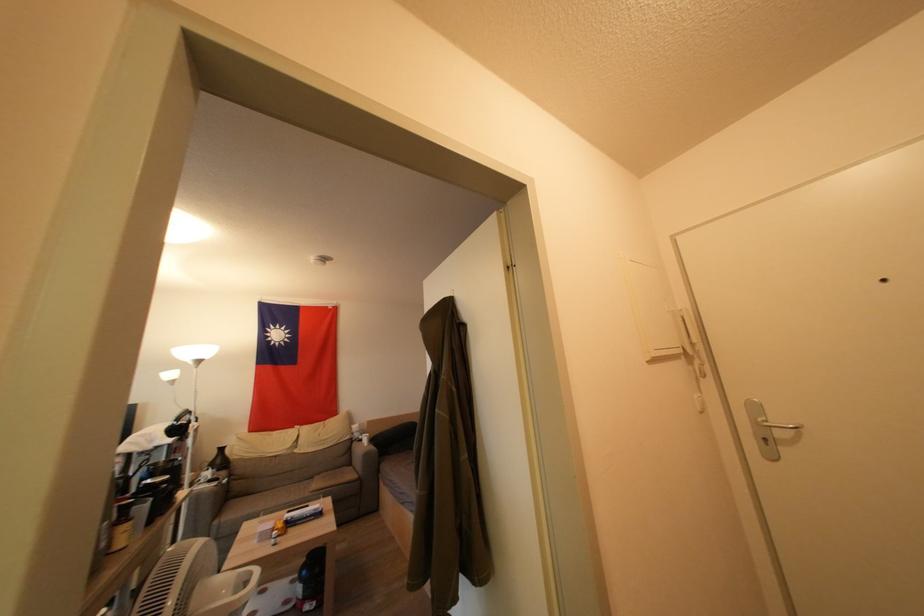
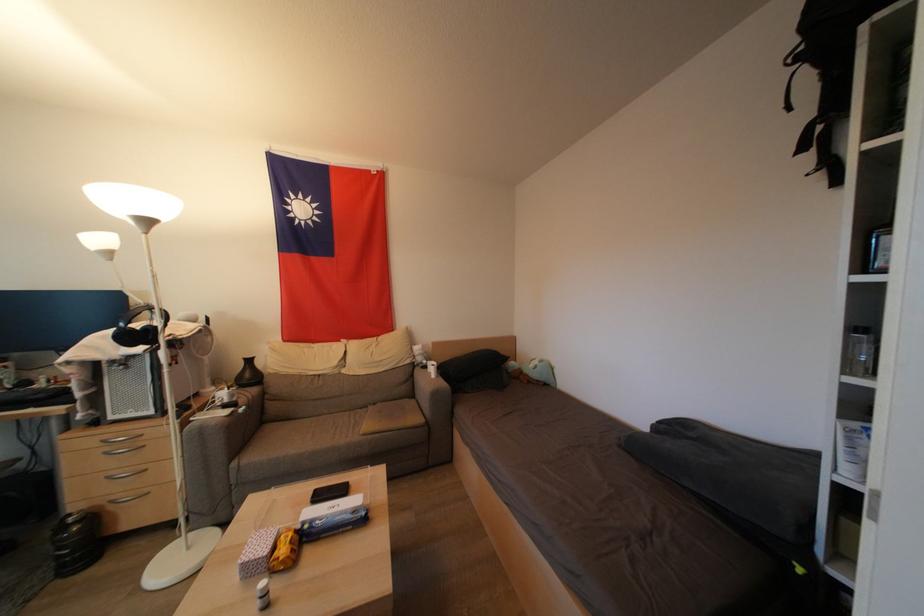
Where in the second image is the point corresponding to point 277,532 from the first image?

(277, 553)